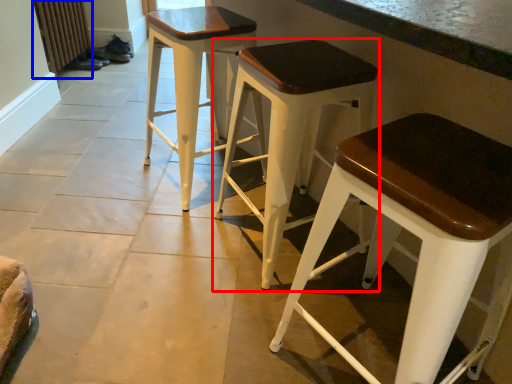
Question: Which point is closer to the camera, stool (highlighted by a red box) or radiator (highlighted by a blue box)?

Choices:
 (A) stool
 (B) radiator

Answer: (A)